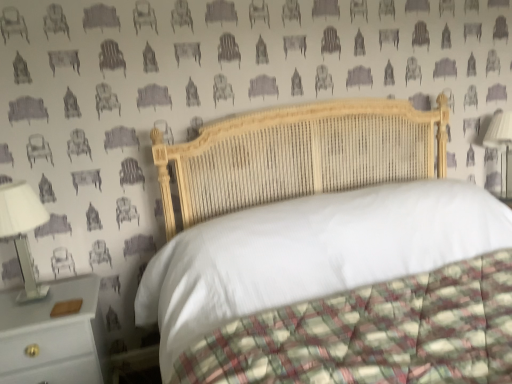
Question: Is white wood nightstand at lower left facing away from wooden bed at center?

Choices:
 (A) no
 (B) yes

Answer: (A)

Question: Can you confirm if white wood nightstand at lower left is taller than wooden bed at center?

Choices:
 (A) no
 (B) yes

Answer: (A)

Question: Is white wood nightstand at lower left positioned in front of wooden bed at center?

Choices:
 (A) yes
 (B) no

Answer: (B)

Question: Is white wood nightstand at lower left to the left of wooden bed at center from the viewer's perspective?

Choices:
 (A) no
 (B) yes

Answer: (B)

Question: Can you confirm if white wood nightstand at lower left is positioned to the right of wooden bed at center?

Choices:
 (A) yes
 (B) no

Answer: (B)

Question: From the image's perspective, is white wood nightstand at lower left on top of wooden bed at center?

Choices:
 (A) no
 (B) yes

Answer: (A)

Question: Is white glossy bedside lamp at left, which appears as the 2th bedside lamp when viewed from the right, completely or partially outside of white fabric lampshade at right, marked as the second bedside lamp in a left-to-right arrangement?

Choices:
 (A) yes
 (B) no

Answer: (A)

Question: Considering the relative sizes of white glossy bedside lamp at left, which is the 1th bedside lamp in left-to-right order, and white fabric lampshade at right, the 2th bedside lamp in the front-to-back sequence, in the image provided, is white glossy bedside lamp at left, which is the 1th bedside lamp in left-to-right order, thinner than white fabric lampshade at right, the 2th bedside lamp in the front-to-back sequence,?

Choices:
 (A) yes
 (B) no

Answer: (A)

Question: Considering the relative positions of white glossy bedside lamp at left, arranged as the first bedside lamp when viewed from the front, and white fabric lampshade at right, marked as the first bedside lamp in a top-to-bottom arrangement, in the image provided, is white glossy bedside lamp at left, arranged as the first bedside lamp when viewed from the front, to the left of white fabric lampshade at right, marked as the first bedside lamp in a top-to-bottom arrangement, from the viewer's perspective?

Choices:
 (A) no
 (B) yes

Answer: (B)

Question: Is white glossy bedside lamp at left, which appears as the 2th bedside lamp when viewed from the top, closer to the viewer compared to white fabric lampshade at right, which is the first bedside lamp from back to front?

Choices:
 (A) no
 (B) yes

Answer: (B)

Question: Is white glossy bedside lamp at left, which is the 2th bedside lamp in back-to-front order, positioned behind white fabric lampshade at right, marked as the second bedside lamp in a left-to-right arrangement?

Choices:
 (A) no
 (B) yes

Answer: (A)

Question: Can you confirm if white glossy bedside lamp at left, which appears as the 2th bedside lamp when viewed from the top, is taller than white fabric lampshade at right, the 2th bedside lamp in the front-to-back sequence?

Choices:
 (A) no
 (B) yes

Answer: (A)

Question: Is wooden bed at center taller than white wood nightstand at lower left?

Choices:
 (A) yes
 (B) no

Answer: (A)